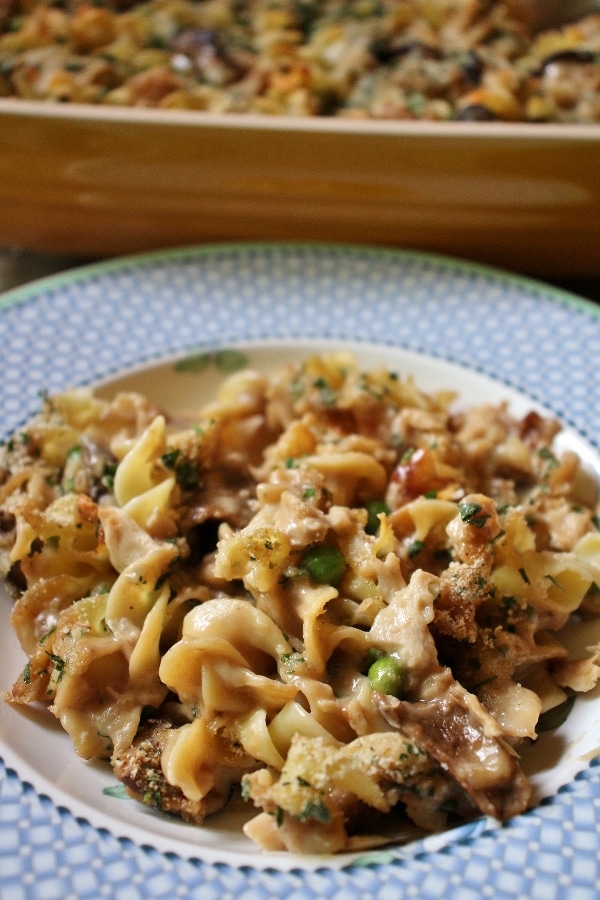
Identify the location of blue white ceramic plate. (536, 876).